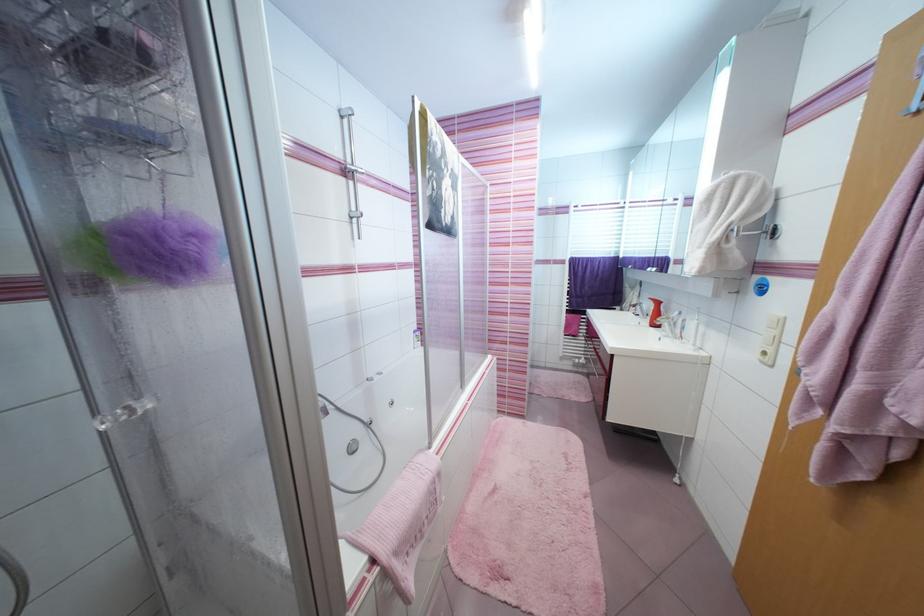
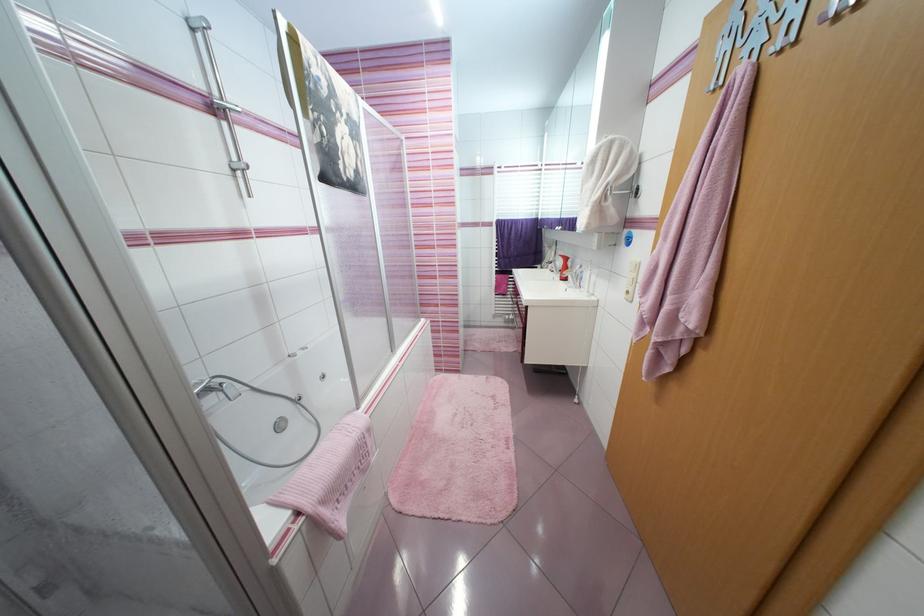
Locate, in the second image, the point that corresponds to pixel 359 222 in the first image.

(245, 175)